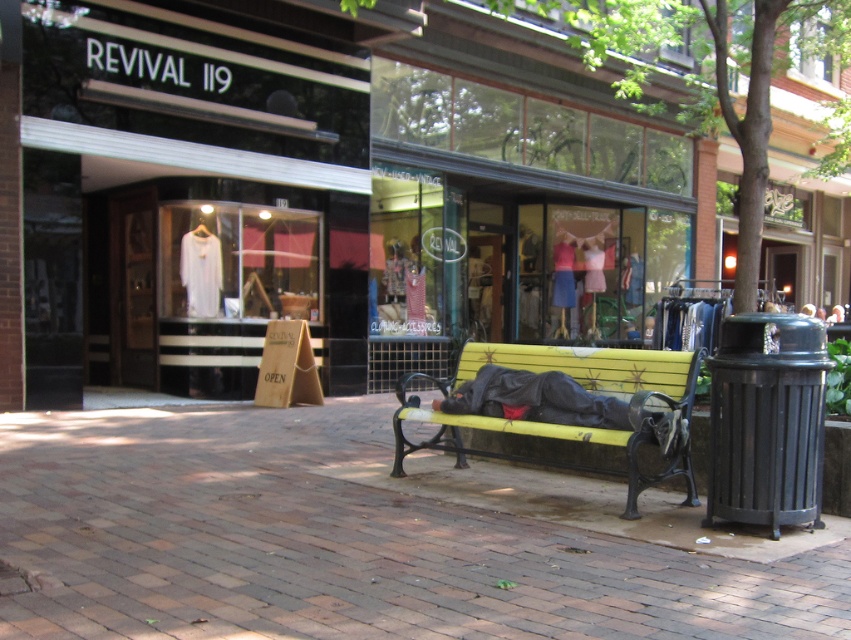
Is the position of brick pavement at center less distant than that of yellow painted wood bench at center?

Yes, brick pavement at center is in front of yellow painted wood bench at center.

Is point (507, 604) positioned in front of point (441, 444)?

Yes.

I want to click on brick pavement at center, so [x=335, y=544].